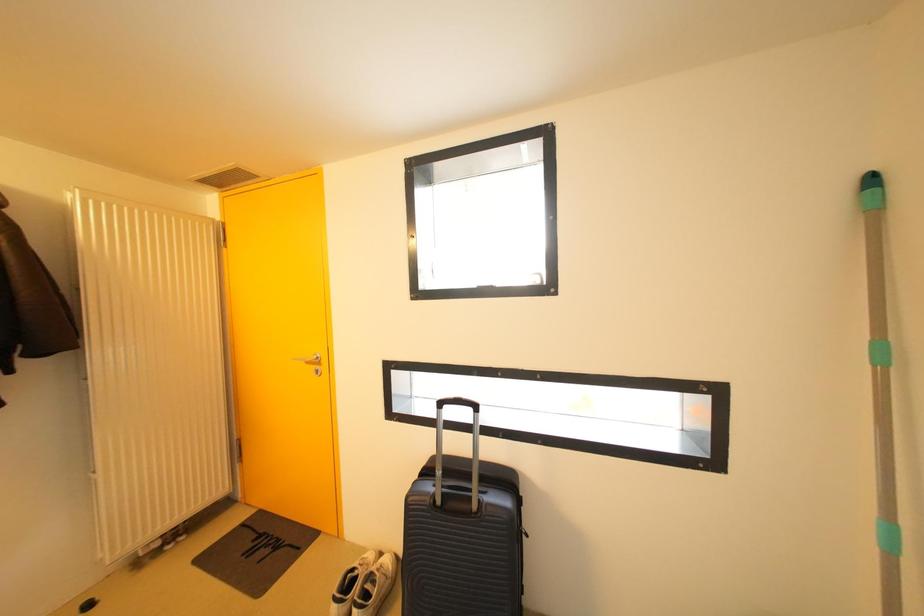
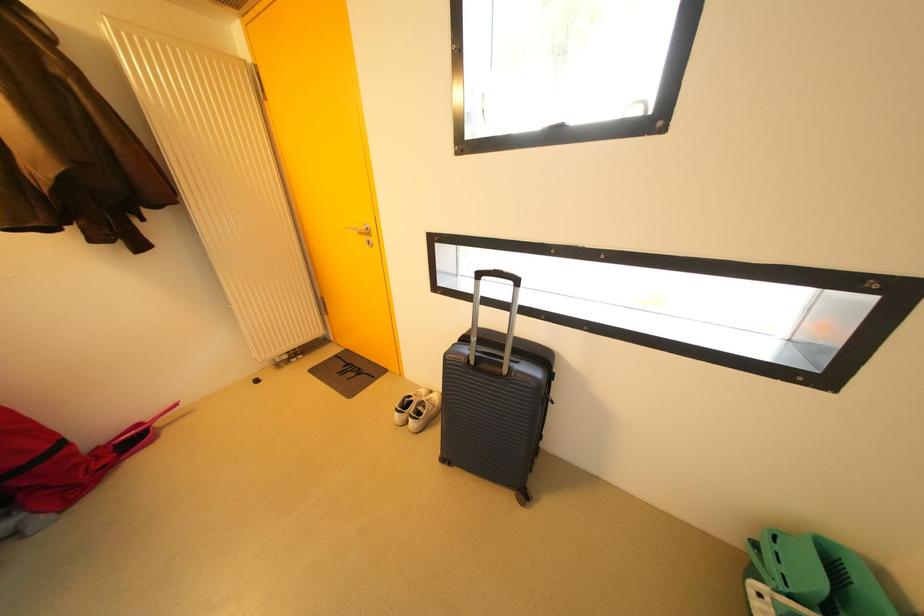
Question: The first image is from the beginning of the video and the second image is from the end. How did the camera likely rotate when shooting the video?

Choices:
 (A) Left
 (B) Right
 (C) Up
 (D) Down

Answer: (D)